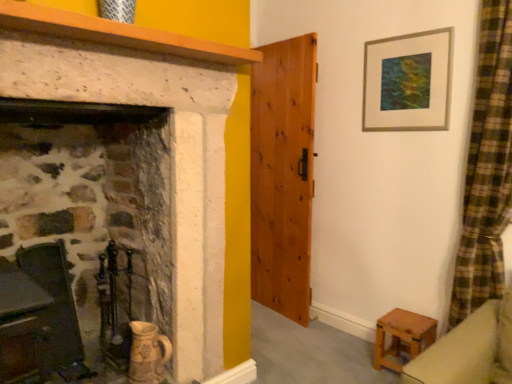
The image size is (512, 384). Describe the element at coordinates (118, 34) in the screenshot. I see `smooth wooden mantle at upper left` at that location.

The width and height of the screenshot is (512, 384). Describe the element at coordinates (283, 175) in the screenshot. I see `natural wood door at center` at that location.

Identify the location of smooth wooden mantle at upper left. (118, 34).

Is wooden chair at left placed right next to natural wood door at center?

No, wooden chair at left is not with natural wood door at center.

Can natural wood door at center be found inside wooden chair at left?

No, wooden chair at left does not contain natural wood door at center.

From a real-world perspective, between wooden chair at left and natural wood door at center, who is vertically higher?

From a 3D spatial view, natural wood door at center is above.

Does wooden chair at left have a larger size compared to smooth wooden mantle at upper left?

Indeed, wooden chair at left has a larger size compared to smooth wooden mantle at upper left.

Between wooden chair at left and smooth wooden mantle at upper left, which one appears on the left side from the viewer's perspective?

Positioned to the left is wooden chair at left.

Which object is thinner, wooden chair at left or smooth wooden mantle at upper left?

wooden chair at left is thinner.

In the scene shown: Is wooden chair at left oriented towards smooth wooden mantle at upper left?

No, wooden chair at left is not oriented towards smooth wooden mantle at upper left.

From a real-world perspective, is wooden chair at left located higher than metallic silver picture frame at upper right?

No, from a real-world perspective, wooden chair at left is not above metallic silver picture frame at upper right.

Would you say wooden chair at left is inside or outside metallic silver picture frame at upper right?

wooden chair at left is not enclosed by metallic silver picture frame at upper right.

Who is shorter, wooden chair at left or metallic silver picture frame at upper right?

metallic silver picture frame at upper right.

Does wooden chair at left have a smaller size compared to metallic silver picture frame at upper right?

Actually, wooden chair at left might be larger than metallic silver picture frame at upper right.

Which is more to the right, natural wood door at center or smooth wooden mantle at upper left?

Positioned to the right is natural wood door at center.

This screenshot has width=512, height=384. I want to click on mantle in front of the natural wood door at center, so [118, 34].

Which object is thinner, natural wood door at center or smooth wooden mantle at upper left?

With smaller width is natural wood door at center.

Between wooden chair at left and wooden stool at lower right, which one appears on the left side from the viewer's perspective?

From the viewer's perspective, wooden chair at left appears more on the left side.

Which is behind, point (113, 335) or point (388, 323)?

The point (388, 323) is more distant.

From the image's perspective, relative to wooden stool at lower right, is wooden chair at left above or below?

Clearly, from the image's perspective, wooden chair at left is above wooden stool at lower right.

Is wooden chair at left positioned with its back to wooden stool at lower right?

No.

Looking at this image, from the image's perspective, is smooth wooden mantle at upper left under wooden stool at lower right?

No, from the image's perspective, smooth wooden mantle at upper left is not beneath wooden stool at lower right.

Who is shorter, smooth wooden mantle at upper left or wooden stool at lower right?

smooth wooden mantle at upper left.

Between smooth wooden mantle at upper left and wooden stool at lower right, which one is positioned behind?

Positioned behind is wooden stool at lower right.

Is smooth wooden mantle at upper left oriented towards wooden stool at lower right?

No, smooth wooden mantle at upper left is not aimed at wooden stool at lower right.

In the image, there is a wooden stool at lower right. In order to click on picture frame above it (from the image's perspective) in this screenshot , I will do `click(407, 82)`.

Could you tell me if metallic silver picture frame at upper right is facing wooden stool at lower right?

No, metallic silver picture frame at upper right is not aimed at wooden stool at lower right.

Considering the sizes of objects metallic silver picture frame at upper right and wooden stool at lower right in the image provided, who is smaller, metallic silver picture frame at upper right or wooden stool at lower right?

With smaller size is metallic silver picture frame at upper right.

Identify the location of chair located below the natural wood door at center (from the image's perspective). This screenshot has height=384, width=512. (114, 308).

Locate an element on the screen. chair beneath the smooth wooden mantle at upper left (from a real-world perspective) is located at coordinates (114, 308).

From the image, which object appears to be nearer to smooth wooden mantle at upper left, wooden chair at left or natural wood door at center?

Based on the image, wooden chair at left appears to be nearer to smooth wooden mantle at upper left.

From the picture: From the image, which object appears to be nearer to natural wood door at center, wooden chair at left or metallic silver picture frame at upper right?

Among the two, metallic silver picture frame at upper right is located nearer to natural wood door at center.

Considering their positions, is wooden stool at lower right positioned further to natural wood door at center than metallic silver picture frame at upper right?

wooden stool at lower right is further to natural wood door at center.

Looking at the image, which one is located further to natural wood door at center, wooden chair at left or wooden stool at lower right?

wooden chair at left is positioned further to the anchor natural wood door at center.

From the image, which object appears to be nearer to natural wood door at center, smooth wooden mantle at upper left or wooden stool at lower right?

wooden stool at lower right.

When comparing their distances from natural wood door at center, does metallic silver picture frame at upper right or wooden stool at lower right seem closer?

The object closer to natural wood door at center is metallic silver picture frame at upper right.

Which object lies nearer to the anchor point natural wood door at center, metallic silver picture frame at upper right or smooth wooden mantle at upper left?

The object closer to natural wood door at center is metallic silver picture frame at upper right.

When comparing their distances from wooden chair at left, does wooden stool at lower right or smooth wooden mantle at upper left seem further?

wooden stool at lower right.

Locate an element on the screen. Image resolution: width=512 pixels, height=384 pixels. mantle between wooden chair at left and metallic silver picture frame at upper right from left to right is located at coordinates (118, 34).

The height and width of the screenshot is (384, 512). Find the location of `mantle that lies between metallic silver picture frame at upper right and wooden stool at lower right from top to bottom`. mantle that lies between metallic silver picture frame at upper right and wooden stool at lower right from top to bottom is located at coordinates (118, 34).

Locate an element on the screen. This screenshot has width=512, height=384. stool between wooden chair at left and metallic silver picture frame at upper right is located at coordinates (402, 337).

This screenshot has height=384, width=512. I want to click on door situated between wooden chair at left and metallic silver picture frame at upper right from left to right, so click(x=283, y=175).